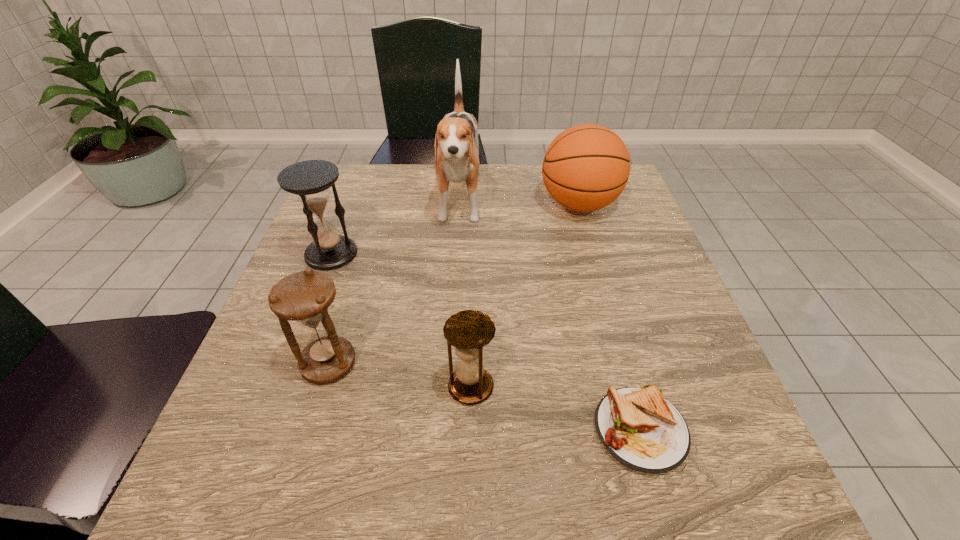
Identify the location of free spot between the puppy and the second shortest object. The height and width of the screenshot is (540, 960). (466, 294).

Select which object is the fourth closest to the tallest object. Please provide its 2D coordinates. Your answer should be formatted as a tuple, i.e. [(x, y)], where the tuple contains the x and y coordinates of a point satisfying the conditions above.

[(469, 331)]

Locate an element on the screen. object identified as the closest to the puppy is located at coordinates (586, 167).

Where is `hourglass that is the third closest to the puppy`? This screenshot has width=960, height=540. hourglass that is the third closest to the puppy is located at coordinates (469, 331).

Choose which hourglass is the nearest neighbor to the farthest hourglass. Please provide its 2D coordinates. Your answer should be formatted as a tuple, i.e. [(x, y)], where the tuple contains the x and y coordinates of a point satisfying the conditions above.

[(304, 297)]

Where is `vacant position in the image that satisfies the following two spatial constraints: 1. at the face of the rightmost hourglass; 2. on the right side of the tallest object`? This screenshot has height=540, width=960. vacant position in the image that satisfies the following two spatial constraints: 1. at the face of the rightmost hourglass; 2. on the right side of the tallest object is located at coordinates (448, 387).

At what (x,y) coordinates should I click in order to perform the action: click on blank space that satisfies the following two spatial constraints: 1. at the face of the basketball; 2. on the right side of the puppy. Please return your answer as a coordinate pair (x, y). Looking at the image, I should click on (459, 205).

Identify the location of vacant region that satisfies the following two spatial constraints: 1. on the front side of the sandwich; 2. on the left side of the farthest hourglass. (264, 430).